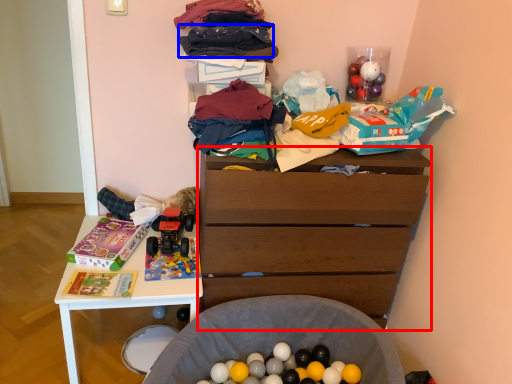
Question: Among these objects, which one is nearest to the camera, chest of drawers (highlighted by a red box) or clothing (highlighted by a blue box)?

Choices:
 (A) chest of drawers
 (B) clothing

Answer: (B)